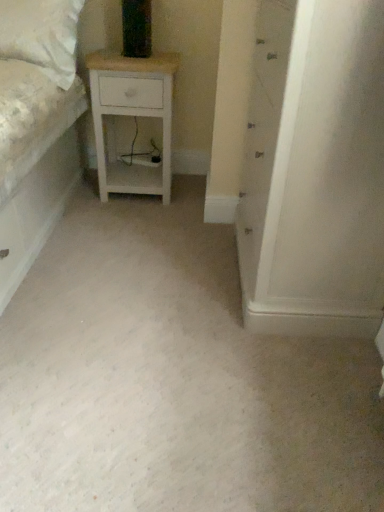
The height and width of the screenshot is (512, 384). Find the location of `free space in front of white matte cabinet at center`. free space in front of white matte cabinet at center is located at coordinates (273, 390).